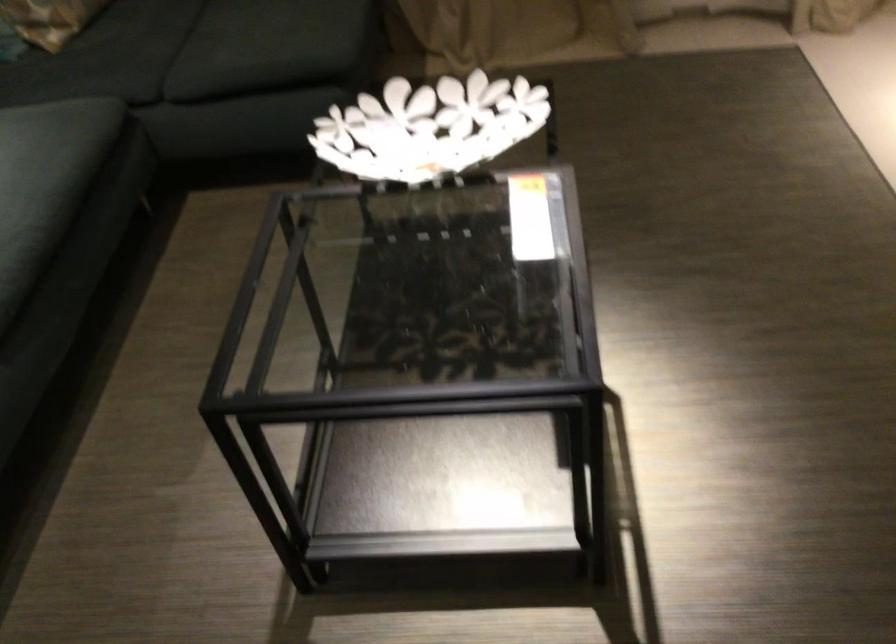
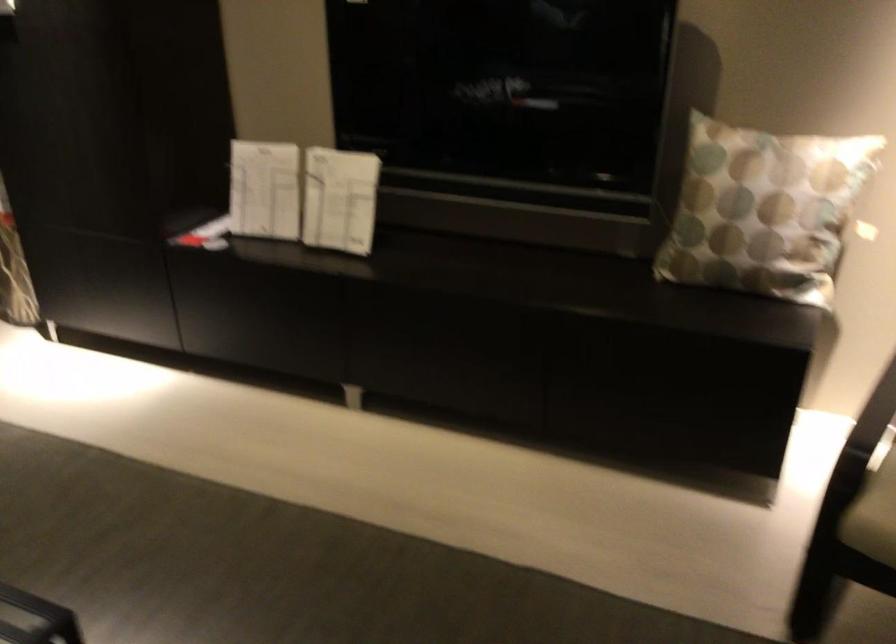
Question: The first image is from the beginning of the video and the second image is from the end. How did the camera likely rotate when shooting the video?

Choices:
 (A) Left
 (B) Right
 (C) Up
 (D) Down

Answer: (B)